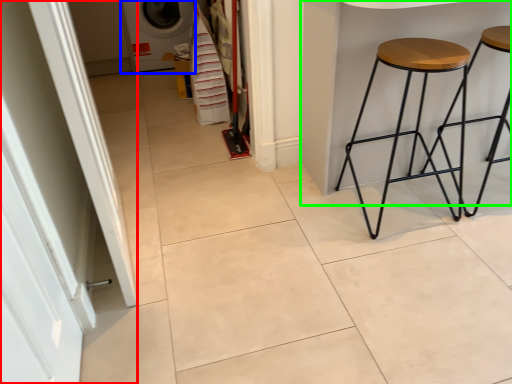
Question: Estimate the real-world distances between objects in this image. Which object is closer to screen door (highlighted by a red box), washing machine (highlighted by a blue box) or table (highlighted by a green box)?

Choices:
 (A) washing machine
 (B) table

Answer: (B)